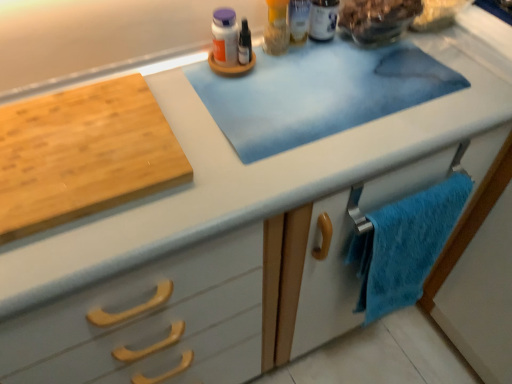
This screenshot has width=512, height=384. In order to click on vacant space that is to the left of white plastic bottle at upper center, which appears as the 2th toiletry when viewed from the left in this screenshot , I will do `click(232, 66)`.